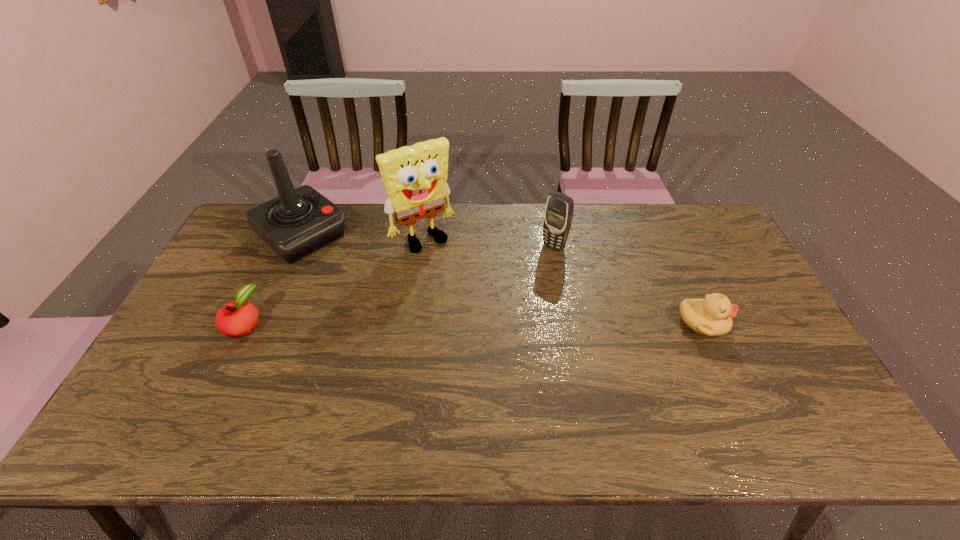
Find the location of a particular element. joystick at the far edge is located at coordinates (299, 221).

This screenshot has width=960, height=540. I want to click on apple situated at the left edge, so click(234, 319).

Locate an element on the screen. Image resolution: width=960 pixels, height=540 pixels. joystick at the left edge is located at coordinates (299, 221).

This screenshot has width=960, height=540. I want to click on object located at the right edge, so click(x=711, y=316).

I want to click on object at the far left corner, so click(299, 221).

You are a GUI agent. You are given a task and a screenshot of the screen. Output one action in this format:
    pyautogui.click(x=<x>, y=<y>)
    Task: Click on the vacant space at the far edge
    The width and height of the screenshot is (960, 540).
    Given the screenshot: What is the action you would take?
    pyautogui.click(x=657, y=236)

Where is `free spot at the near edge of the desktop`? free spot at the near edge of the desktop is located at coordinates (232, 401).

You are a GUI agent. You are given a task and a screenshot of the screen. Output one action in this format:
    pyautogui.click(x=<x>, y=<y>)
    Task: Click on the free space at the left edge of the desktop
    The width and height of the screenshot is (960, 540).
    Given the screenshot: What is the action you would take?
    pyautogui.click(x=204, y=350)

Where is `vacant space at the far right corner of the desktop`? Image resolution: width=960 pixels, height=540 pixels. vacant space at the far right corner of the desktop is located at coordinates (694, 231).

Locate an element on the screen. This screenshot has width=960, height=540. vacant space in between the joystick and the sponge is located at coordinates (363, 238).